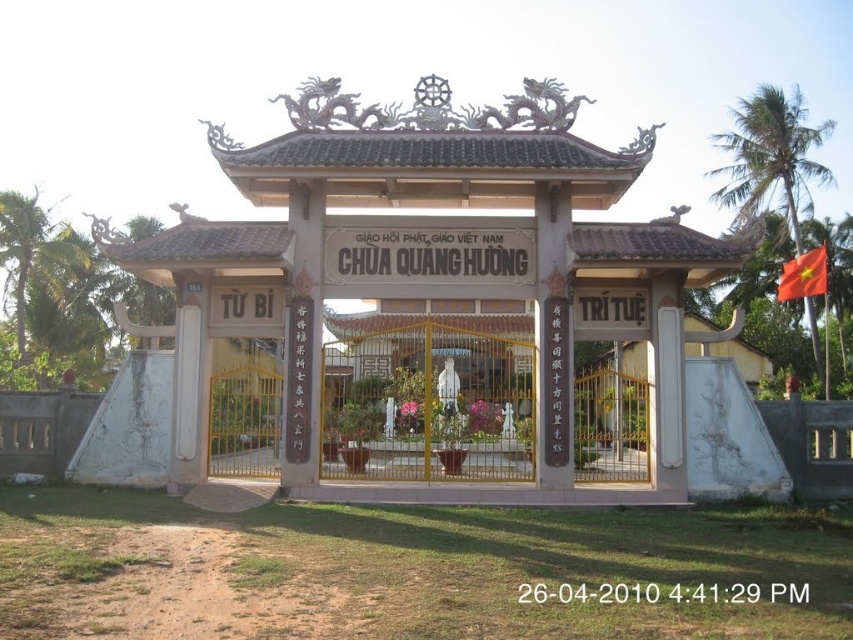
You are a visitor approaching the entrance of Chua Quang Huong temple. You see the metallic gate at center and the red fabric flag at upper right. Which object is bigger in size?

The metallic gate at center is larger in size compared to the red fabric flag at upper right.

You are a visitor approaching the entrance of Chua Quang Huong temple. You see a white stone gazebo at center and a metallic gate at center. Which object is closer to you as you approach the temple entrance?

The white stone gazebo at center is positioned over the metallic gate at center, so the white stone gazebo at center is closer to you as you approach the temple entrance.